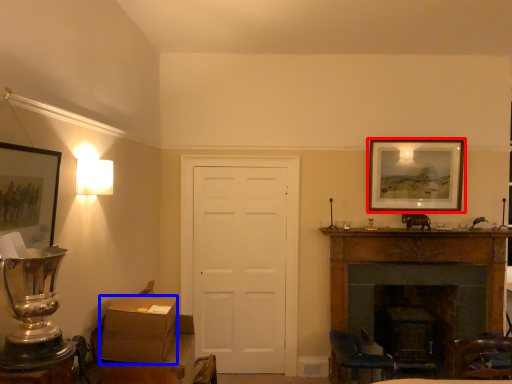
Question: Which of the following is the closest to the observer, picture frame (highlighted by a red box) or box (highlighted by a blue box)?

Choices:
 (A) picture frame
 (B) box

Answer: (B)